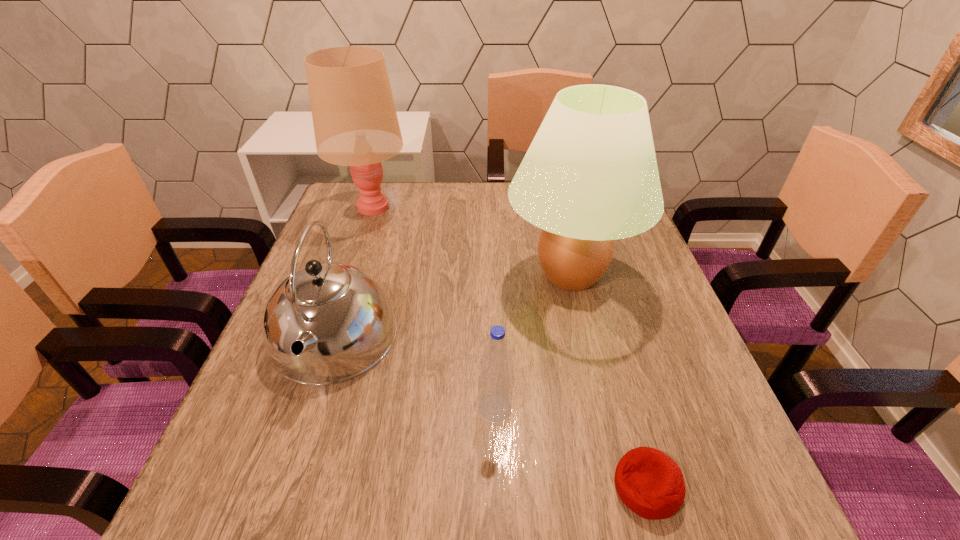
This screenshot has height=540, width=960. In order to click on object that is the third closest to the shortest object in this screenshot , I will do `click(327, 323)`.

Locate which object ranks in proximity to the right lampshade. Please provide its 2D coordinates. Your answer should be formatted as a tuple, i.e. [(x, y)], where the tuple contains the x and y coordinates of a point satisfying the conditions above.

[(495, 388)]

Find the location of `free space that satisfies the following two spatial constraints: 1. on the shade of the nearer lampshade; 2. from the spout of the kettle`. free space that satisfies the following two spatial constraints: 1. on the shade of the nearer lampshade; 2. from the spout of the kettle is located at coordinates (586, 339).

Image resolution: width=960 pixels, height=540 pixels. I want to click on vacant space that satisfies the following two spatial constraints: 1. on the shade of the right lampshade; 2. from the spout of the third shortest object, so click(x=586, y=339).